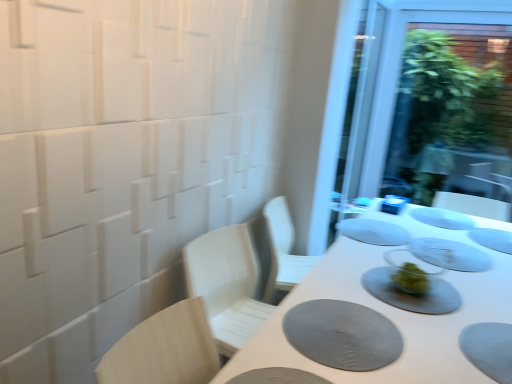
You are a GUI agent. You are given a task and a screenshot of the screen. Output one action in this format:
    pyautogui.click(x=<x>, y=<y>)
    Task: Click on the free spot above gray textured placemat at lower right (from a real-world perspective)
    
    Given the screenshot: What is the action you would take?
    pyautogui.click(x=350, y=331)